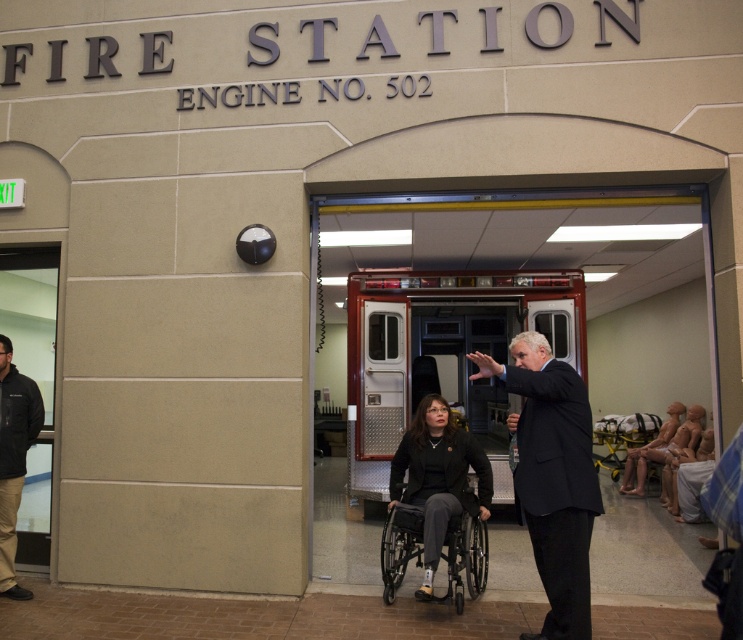
Question: Among these objects, which one is nearest to the camera?

Choices:
 (A) smooth beige mannequin at right
 (B) metallic silver fire truck at center
 (C) black plastic wheelchair at center

Answer: (C)

Question: Does black jacket at left have a lesser width compared to smooth beige mannequin at right?

Choices:
 (A) yes
 (B) no

Answer: (A)

Question: Which of these objects is positioned closest to the metallic silver fire truck at center?

Choices:
 (A) smooth beige mannequin at right
 (B) black plastic wheelchair at center
 (C) black jacket at left
 (D) dark suit at center

Answer: (A)

Question: In this image, where is black plastic wheelchair at center located relative to black jacket at left?

Choices:
 (A) right
 (B) left

Answer: (A)

Question: Estimate the real-world distances between objects in this image. Which object is farther from the dark suit at center?

Choices:
 (A) metallic silver fire truck at center
 (B) smooth beige mannequin at right
 (C) black plastic wheelchair at center
 (D) black jacket at left

Answer: (B)

Question: Does dark suit at center have a larger size compared to black plastic wheelchair at center?

Choices:
 (A) no
 (B) yes

Answer: (B)